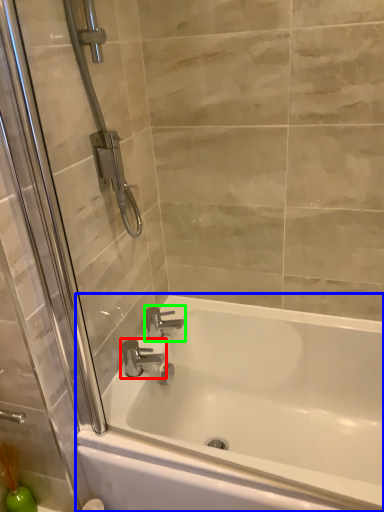
Question: Which is farther away from tap (highlighted by a red box)? bathtub (highlighted by a blue box) or tap (highlighted by a green box)?

Choices:
 (A) bathtub
 (B) tap

Answer: (A)